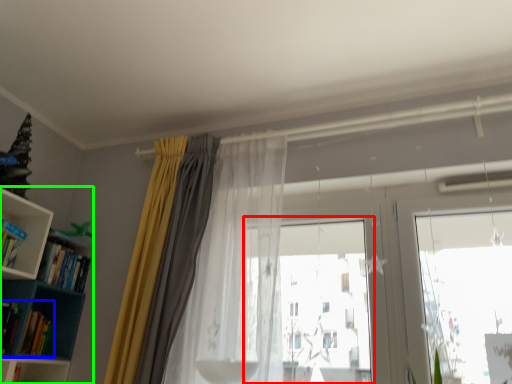
Question: Which is nearer to the bay window (highlighted by a red box)? book (highlighted by a blue box) or bookcase (highlighted by a green box).

Choices:
 (A) book
 (B) bookcase

Answer: (B)